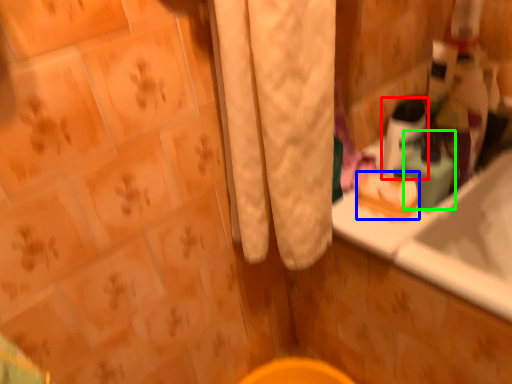
Question: Based on their relative distances, which object is farther from mouthwash (highlighted by a red box)? Choose from soap (highlighted by a blue box) and mouthwash (highlighted by a green box).

Choices:
 (A) soap
 (B) mouthwash

Answer: (A)